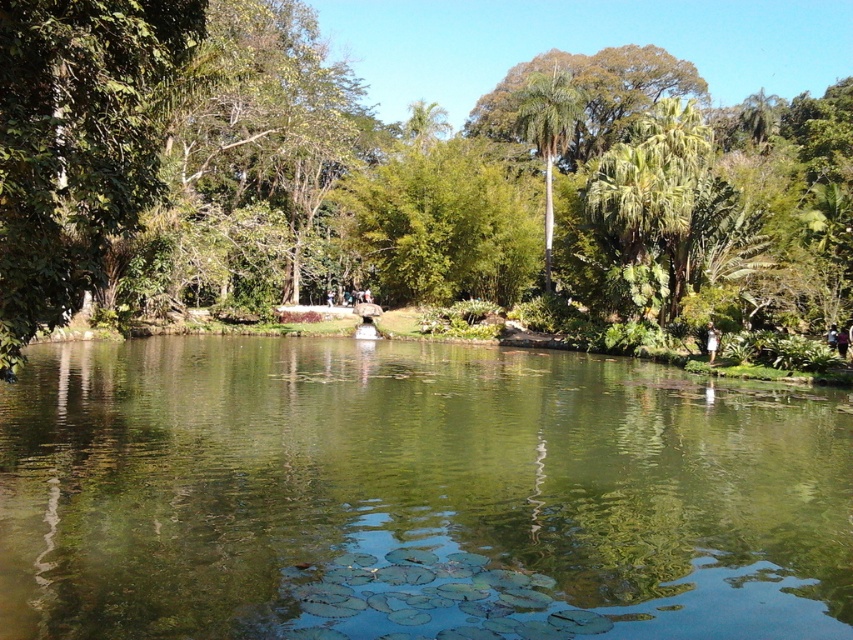
Between green reflective water at center and green leafy palm tree at center, which one is positioned higher?

green leafy palm tree at center is above.

Is point (206, 557) less distant than point (560, 138)?

Yes, point (206, 557) is in front of point (560, 138).

The height and width of the screenshot is (640, 853). I want to click on green reflective water at center, so click(412, 493).

Who is shorter, green leafy tree at center or green leafy palm tree at center?

green leafy palm tree at center is shorter.

In the scene shown: Which is more to the right, green leafy tree at center or green leafy palm tree at center?

green leafy palm tree at center is more to the right.

The image size is (853, 640). What are the coordinates of `green leafy tree at center` in the screenshot? It's located at (393, 179).

Consider the image. Can you confirm if green reflective water at center is thinner than green leafy tree at center?

Indeed, green reflective water at center has a lesser width compared to green leafy tree at center.

Who is positioned more to the right, green reflective water at center or green leafy tree at center?

Positioned to the right is green leafy tree at center.

Where is `green reflective water at center`? green reflective water at center is located at coordinates (412, 493).